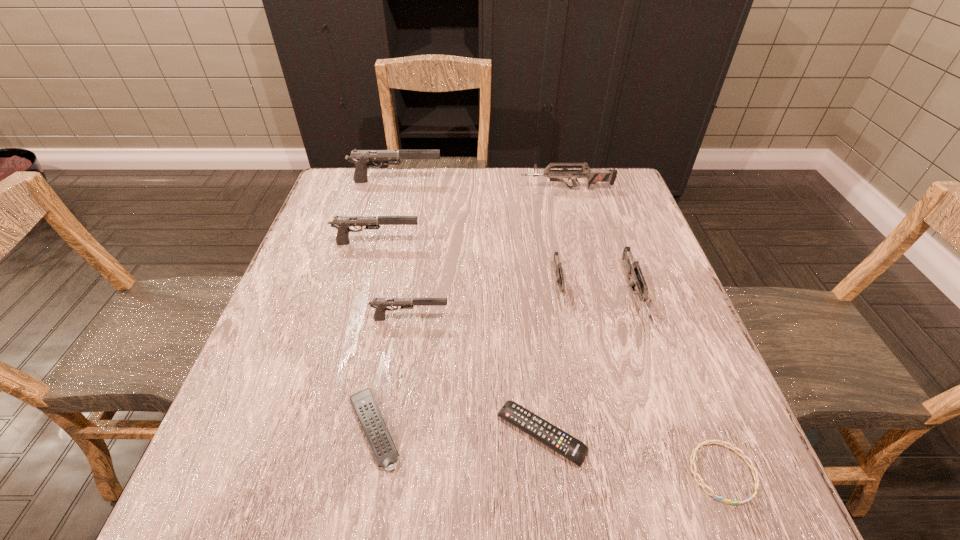
Locate an element on the screen. This screenshot has height=540, width=960. free space at the left edge of the desktop is located at coordinates (215, 449).

Locate an element on the screen. This screenshot has height=540, width=960. free spot at the right edge of the desktop is located at coordinates (659, 285).

Locate an element on the screen. free space at the far left corner is located at coordinates (344, 172).

This screenshot has height=540, width=960. In order to click on vacant space at the near left corner of the desktop in this screenshot , I will do `click(195, 504)`.

Find the location of `vacant space at the far right corner of the desktop`. vacant space at the far right corner of the desktop is located at coordinates (612, 210).

Locate an element on the screen. vacant area between the smallest gray gun and the bracelet is located at coordinates (566, 395).

The image size is (960, 540). I want to click on free spot between the blue bracelet and the biggest grey gun, so (x=644, y=330).

Locate an element on the screen. vacant point located between the black remote control and the second smallest grey gun is located at coordinates (588, 364).

At what (x,y) coordinates should I click in order to perform the action: click on free space that is in between the biggest gray gun and the second smallest gray gun. Please return your answer as a coordinate pair (x, y). The image size is (960, 540). Looking at the image, I should click on (386, 212).

Find the location of `free space between the shortest gun and the left remote control`. free space between the shortest gun and the left remote control is located at coordinates (467, 358).